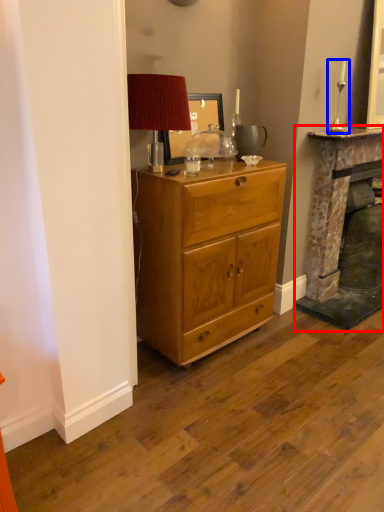
Question: Which point is closer to the camera, fireplace (highlighted by a red box) or candle holder (highlighted by a blue box)?

Choices:
 (A) fireplace
 (B) candle holder

Answer: (B)